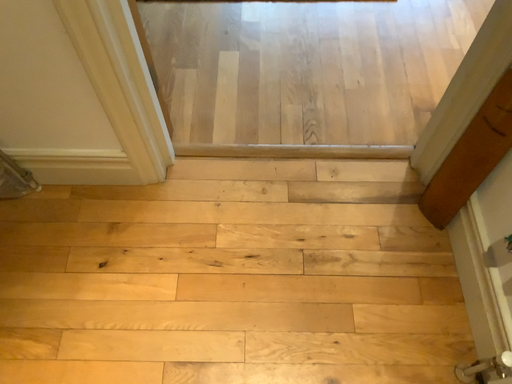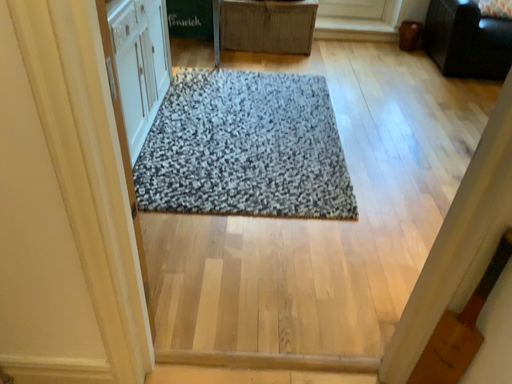
Question: Which way did the camera rotate in the video?

Choices:
 (A) rotated upward
 (B) rotated downward

Answer: (A)